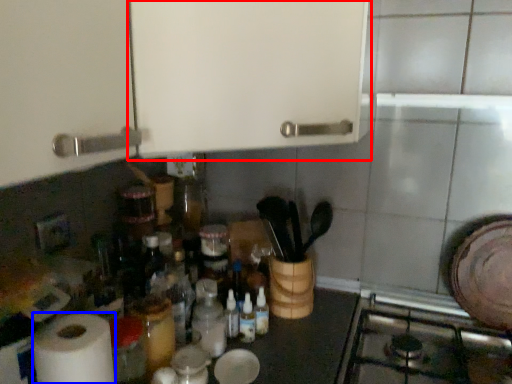
Question: Which object appears closest to the camera in this image, cabinetry (highlighted by a red box) or paper towel (highlighted by a blue box)?

Choices:
 (A) cabinetry
 (B) paper towel

Answer: (A)